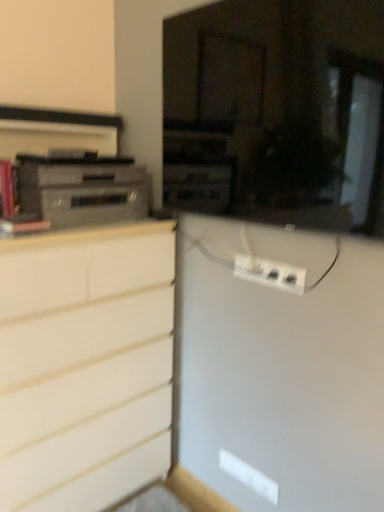
Question: Is white matte chest of drawers at left positioned with its back to satin silver stereo at left?

Choices:
 (A) no
 (B) yes

Answer: (A)

Question: From the image's perspective, does white matte chest of drawers at left appear higher than satin silver stereo at left?

Choices:
 (A) yes
 (B) no

Answer: (B)

Question: Can you see white matte chest of drawers at left touching satin silver stereo at left?

Choices:
 (A) no
 (B) yes

Answer: (A)

Question: Is white matte chest of drawers at left further to the viewer compared to satin silver stereo at left?

Choices:
 (A) no
 (B) yes

Answer: (A)

Question: Is white matte chest of drawers at left bigger than satin silver stereo at left?

Choices:
 (A) no
 (B) yes

Answer: (B)

Question: Is white matte chest of drawers at left shorter than satin silver stereo at left?

Choices:
 (A) no
 (B) yes

Answer: (A)

Question: Is white plastic power strip at center at the right side of white matte chest of drawers at left?

Choices:
 (A) no
 (B) yes

Answer: (B)

Question: Is white plastic power strip at center further to the viewer compared to white matte chest of drawers at left?

Choices:
 (A) yes
 (B) no

Answer: (A)

Question: Would you say white plastic power strip at center contains white matte chest of drawers at left?

Choices:
 (A) no
 (B) yes

Answer: (A)

Question: Can you see white plastic power strip at center touching white matte chest of drawers at left?

Choices:
 (A) yes
 (B) no

Answer: (B)

Question: Can you confirm if white plastic power strip at center is taller than white matte chest of drawers at left?

Choices:
 (A) yes
 (B) no

Answer: (B)

Question: From the image's perspective, does white plastic power strip at center appear higher than white matte chest of drawers at left?

Choices:
 (A) yes
 (B) no

Answer: (A)

Question: Is satin silver stereo at left thinner than white plastic power strip at center?

Choices:
 (A) no
 (B) yes

Answer: (A)